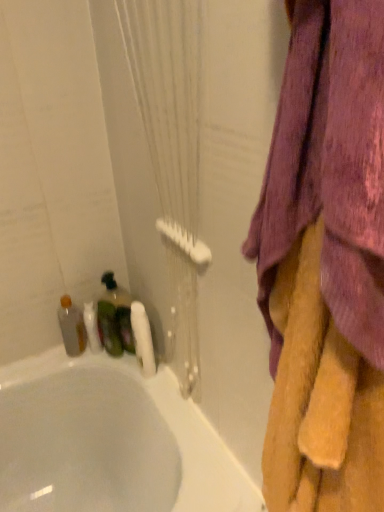
Question: Is white textured shower curtain at left to the left of white matte toilet paper at lower left from the viewer's perspective?

Choices:
 (A) no
 (B) yes

Answer: (A)

Question: Does white textured shower curtain at left lie in front of white matte toilet paper at lower left?

Choices:
 (A) yes
 (B) no

Answer: (A)

Question: From a real-world perspective, is white textured shower curtain at left positioned over white matte toilet paper at lower left based on gravity?

Choices:
 (A) no
 (B) yes

Answer: (B)

Question: Can you confirm if white textured shower curtain at left is smaller than white matte toilet paper at lower left?

Choices:
 (A) yes
 (B) no

Answer: (B)

Question: From a real-world perspective, is white textured shower curtain at left beneath white matte toilet paper at lower left?

Choices:
 (A) yes
 (B) no

Answer: (B)

Question: Is white textured shower curtain at left not within white matte toilet paper at lower left?

Choices:
 (A) no
 (B) yes

Answer: (B)

Question: From the image's perspective, is white glossy bathtub at lower left located above white textured shower curtain at left?

Choices:
 (A) yes
 (B) no

Answer: (B)

Question: Is white glossy bathtub at lower left outside of white textured shower curtain at left?

Choices:
 (A) yes
 (B) no

Answer: (A)

Question: Can you confirm if white glossy bathtub at lower left is positioned to the left of white textured shower curtain at left?

Choices:
 (A) no
 (B) yes

Answer: (B)

Question: Is white textured shower curtain at left a part of white glossy bathtub at lower left?

Choices:
 (A) no
 (B) yes

Answer: (A)

Question: From the image's perspective, is white glossy bathtub at lower left beneath white textured shower curtain at left?

Choices:
 (A) no
 (B) yes

Answer: (B)

Question: Is white glossy bathtub at lower left in front of white textured shower curtain at left?

Choices:
 (A) yes
 (B) no

Answer: (B)

Question: From the image's perspective, would you say white matte toilet paper at lower left is shown under translucent plastic bottle at left, positioned as the 1th bottle in left-to-right order?

Choices:
 (A) yes
 (B) no

Answer: (A)